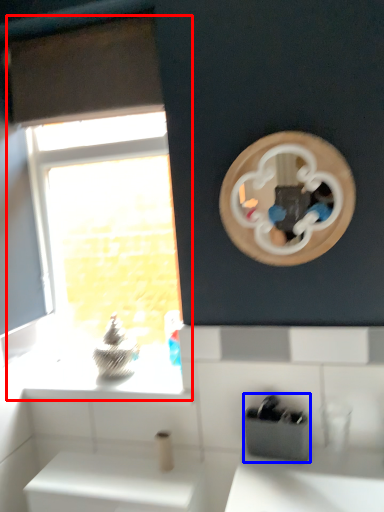
Question: Which object appears farthest to the camera in this image, window (highlighted by a red box) or appliance (highlighted by a blue box)?

Choices:
 (A) window
 (B) appliance

Answer: (A)